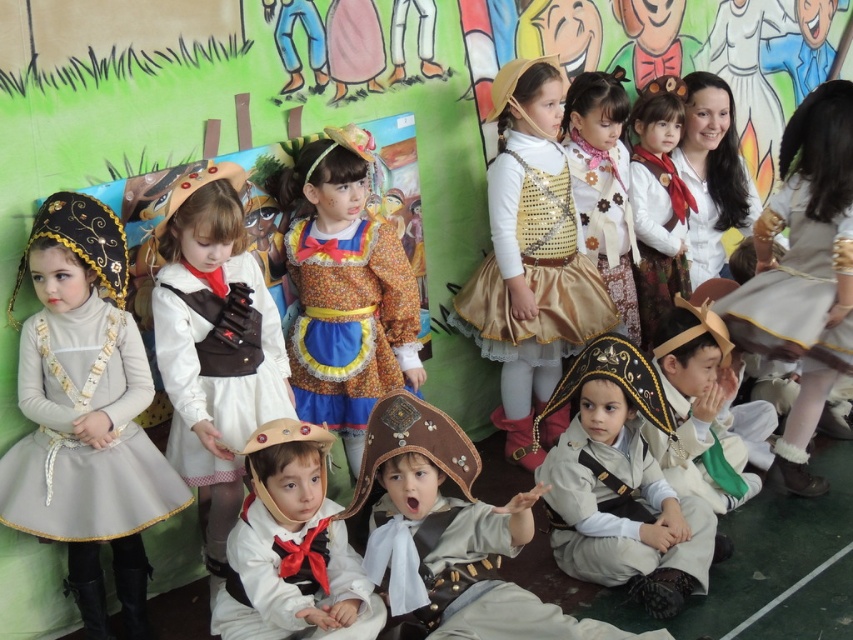
The image size is (853, 640). Find the location of `matte brown pirate hat at center`. matte brown pirate hat at center is located at coordinates (456, 529).

Can you confirm if matte brown pirate hat at center is taller than shiny gold vest at center?

No.

Is point (525, 593) positioned before point (601, 244)?

Yes, point (525, 593) is closer to viewer.

Locate an element on the screen. matte brown pirate hat at center is located at coordinates (456, 529).

Who is positioned more to the left, light gray satin dress at left or matte gold vest at upper right?

From the viewer's perspective, light gray satin dress at left appears more on the left side.

Which is behind, point (22, 508) or point (637, 243)?

Positioned behind is point (637, 243).

Which is in front, point (73, 529) or point (683, 209)?

Point (73, 529)

Where is `light gray satin dress at left`? light gray satin dress at left is located at coordinates (77, 440).

Is point (641, 396) farther from camera compared to point (270, 316)?

Yes, it is behind point (270, 316).

The height and width of the screenshot is (640, 853). What are the coordinates of `matte brown hat at center` in the screenshot? It's located at (621, 484).

You are a GUI agent. You are given a task and a screenshot of the screen. Output one action in this format:
    pyautogui.click(x=<x>, y=<y>)
    Task: Click on the matte brown hat at center
    
    Given the screenshot: What is the action you would take?
    pyautogui.click(x=621, y=484)